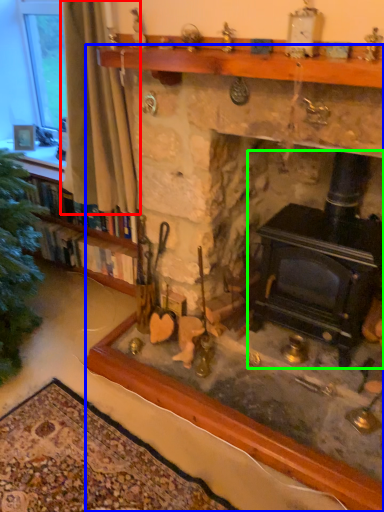
Question: Which object is the farthest from curtain (highlighted by a red box)? Choose among these: fireplace (highlighted by a blue box) or wood burning stove (highlighted by a green box).

Choices:
 (A) fireplace
 (B) wood burning stove

Answer: (A)